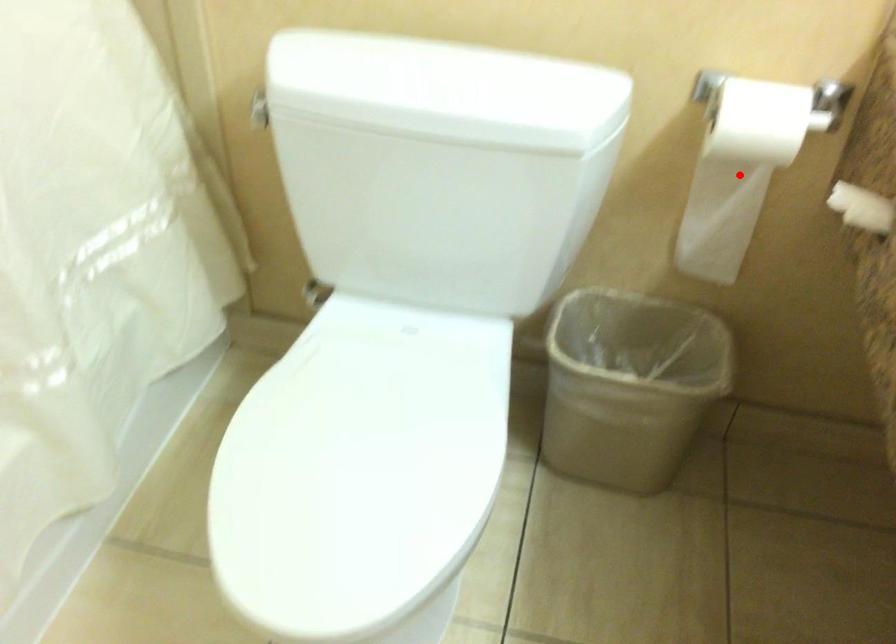
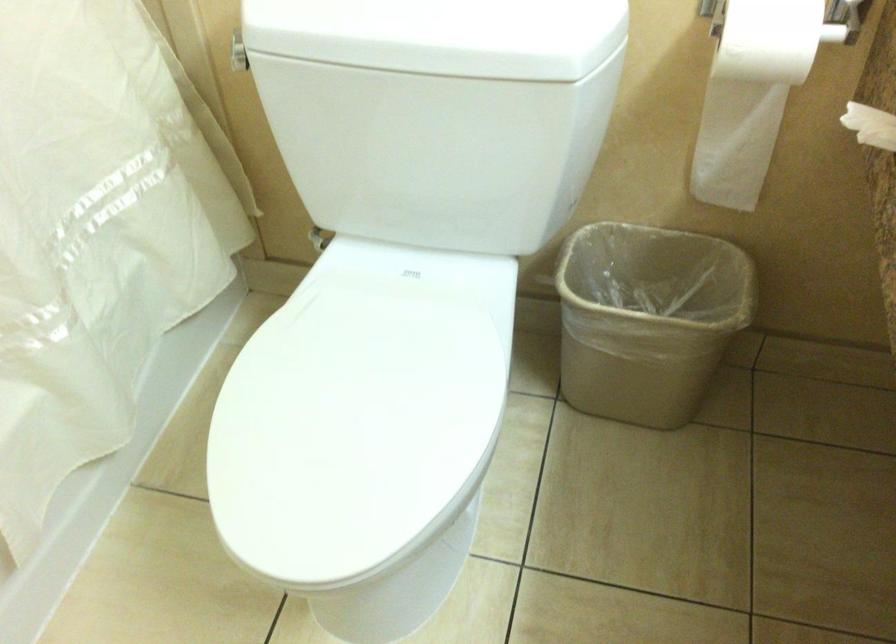
Find the pixel in the second image that matches the highlighted location in the first image.

(752, 93)